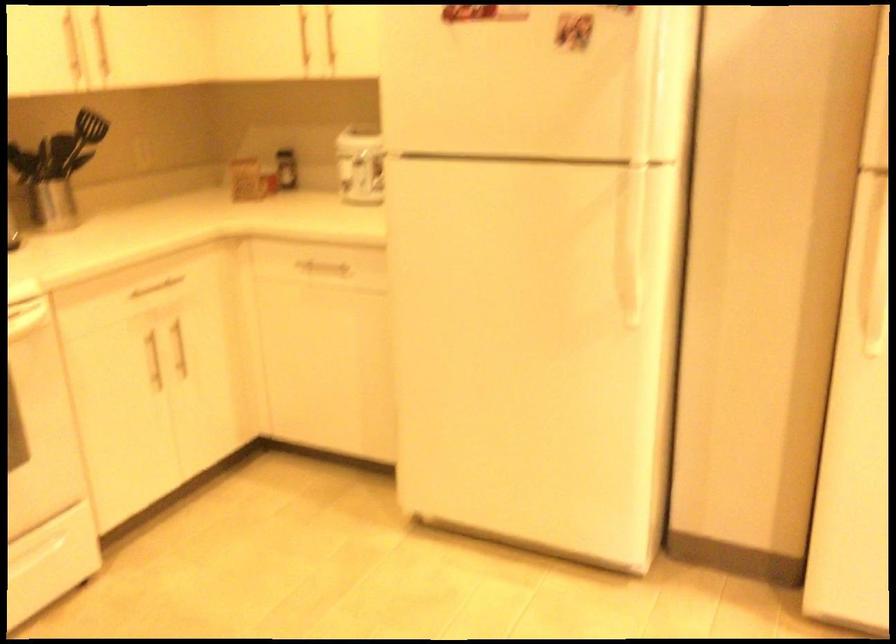
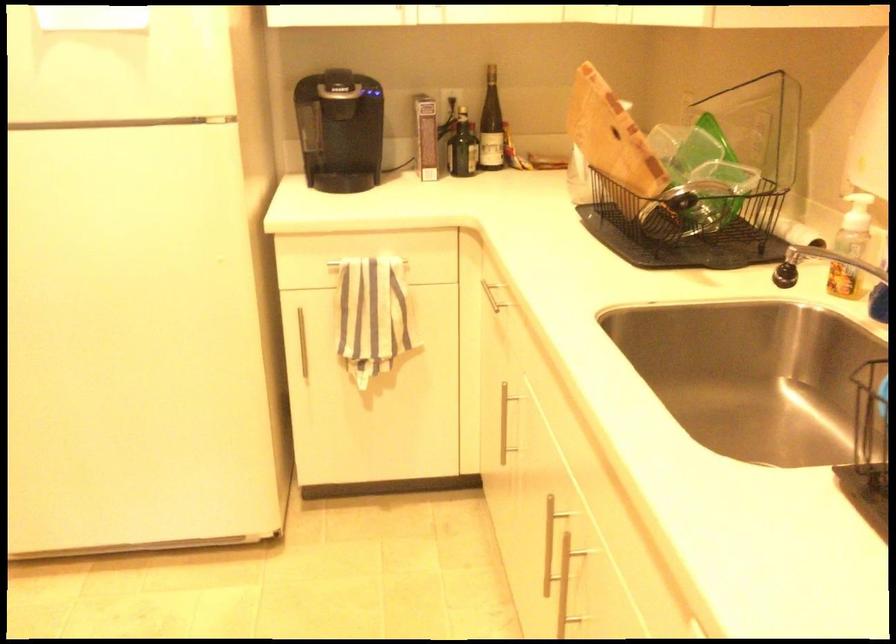
Question: In a continuous first-person perspective shot, in which direction is the camera moving?

Choices:
 (A) Left
 (B) Right
 (C) Forward
 (D) Backward

Answer: (B)